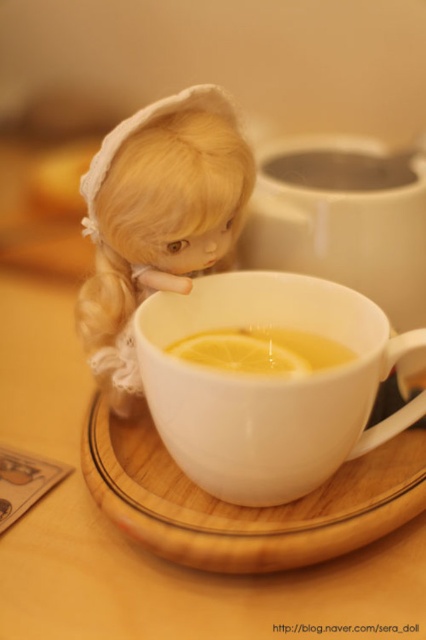
Who is positioned more to the left, white glossy teacup at center or yellow matte lemon at center?

yellow matte lemon at center

Between point (334, 378) and point (181, 358), which one is positioned behind?

The point (181, 358) is behind.

Based on the photo, measure the distance between white glossy teacup at center and camera.

white glossy teacup at center is 24.94 inches from camera.

The height and width of the screenshot is (640, 426). Find the location of `white glossy teacup at center`. white glossy teacup at center is located at coordinates (268, 385).

Who is more distant from viewer, (235, 476) or (368, 170)?

Point (368, 170)

Which is below, white glossy teacup at center or translucent glass cup at upper center?

white glossy teacup at center is below.

Who is more distant from viewer, (256, 496) or (278, 157)?

Point (278, 157)

Locate an element on the screen. Image resolution: width=426 pixels, height=640 pixels. white glossy teacup at center is located at coordinates (268, 385).

Does translucent glass cup at upper center have a lesser width compared to yellow matte lemon at center?

No.

Who is more forward, (x=327, y=179) or (x=291, y=352)?

Positioned in front is point (x=291, y=352).

At what (x,y) coordinates should I click in order to perform the action: click on translucent glass cup at upper center. Please return your answer as a coordinate pair (x, y). The width and height of the screenshot is (426, 640). Looking at the image, I should click on (342, 170).